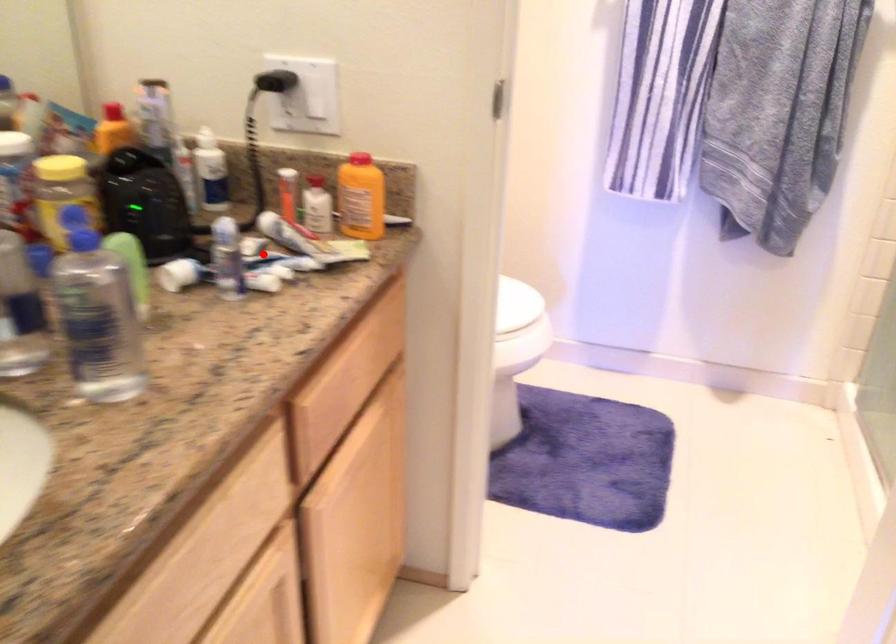
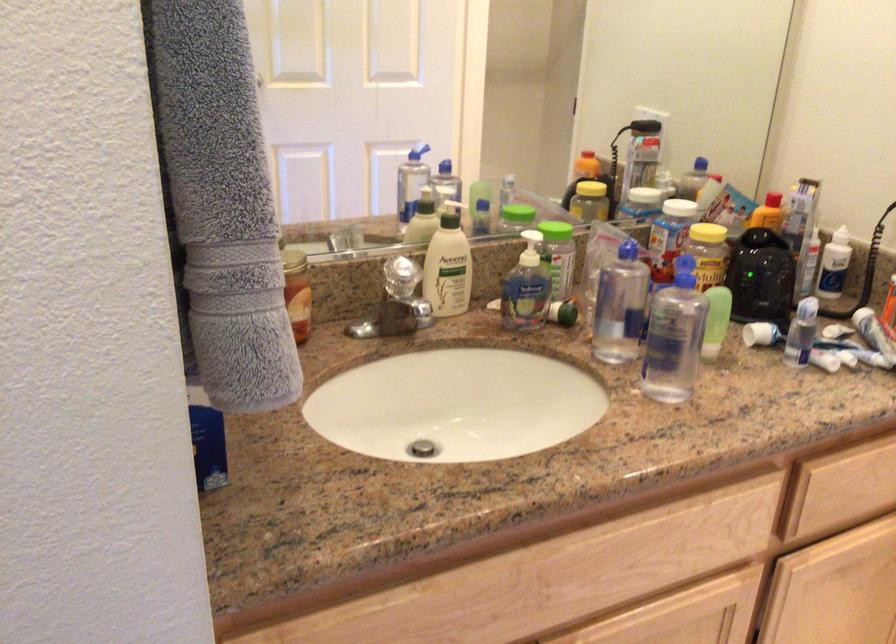
Locate, in the second image, the point that corresponds to the highlighted location in the first image.

(839, 339)